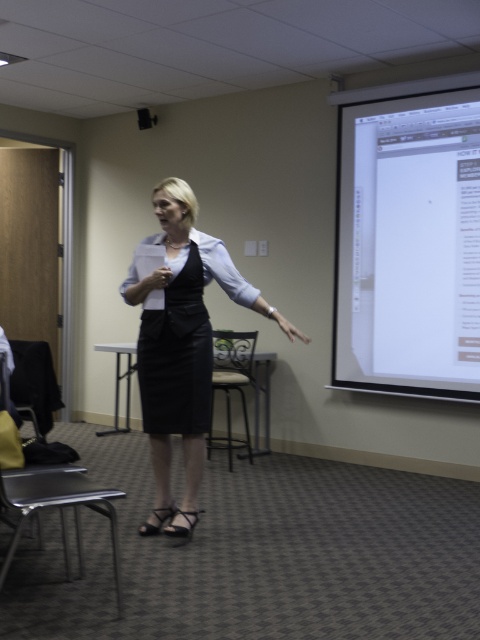
Is black satin skirt at center shorter than beige fabric chair at center?

No, black satin skirt at center is not shorter than beige fabric chair at center.

What do you see at coordinates (182, 348) in the screenshot? I see `black satin skirt at center` at bounding box center [182, 348].

Identify the location of black satin skirt at center. (182, 348).

Based on the photo, how distant is white glossy projection screen at upper right from beige fabric chair at center?

white glossy projection screen at upper right is 4.55 feet from beige fabric chair at center.

Which of these two, white glossy projection screen at upper right or beige fabric chair at center, stands shorter?

Standing shorter between the two is beige fabric chair at center.

Locate an element on the screen. Image resolution: width=480 pixels, height=640 pixels. white glossy projection screen at upper right is located at coordinates (408, 237).

Where is `white glossy projection screen at upper right`? This screenshot has height=640, width=480. white glossy projection screen at upper right is located at coordinates (408, 237).

Can you confirm if white glossy projection screen at upper right is wider than black leather dress at center?

Indeed, white glossy projection screen at upper right has a greater width compared to black leather dress at center.

Which of these two, white glossy projection screen at upper right or black leather dress at center, stands taller?

With more height is white glossy projection screen at upper right.

Does point (467, 80) come behind point (169, 317)?

Yes, it is.

Image resolution: width=480 pixels, height=640 pixels. Identify the location of white glossy projection screen at upper right. (408, 237).